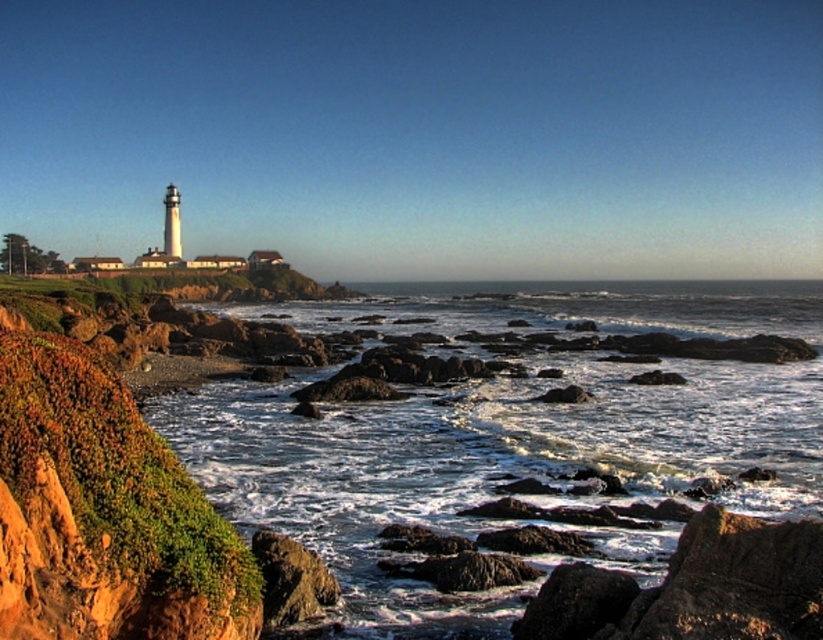
From the picture: Can you confirm if white frothy water at lower center is bigger than rustic rock cliff at left?

Yes, white frothy water at lower center is bigger than rustic rock cliff at left.

Is white frothy water at lower center to the right of rustic rock cliff at left from the viewer's perspective?

Indeed, white frothy water at lower center is positioned on the right side of rustic rock cliff at left.

Is point (661, 552) positioned in front of point (1, 536)?

No.

Where is `white frothy water at lower center`? white frothy water at lower center is located at coordinates (505, 428).

Can you confirm if white frothy water at lower center is positioned to the right of rusty rock at lower left?

Yes, white frothy water at lower center is to the right of rusty rock at lower left.

Which is more to the right, white frothy water at lower center or rusty rock at lower left?

white frothy water at lower center is more to the right.

Who is more distant from viewer, (x=431, y=516) or (x=310, y=612)?

The point (x=431, y=516) is behind.

Where is `white frothy water at lower center`? white frothy water at lower center is located at coordinates [505, 428].

Between rustic rock cliff at left and rusty rock at lower left, which one has less height?

Standing shorter between the two is rusty rock at lower left.

Who is taller, rustic rock cliff at left or rusty rock at lower left?

rustic rock cliff at left is taller.

Where is `rustic rock cliff at left`? rustic rock cliff at left is located at coordinates (x=103, y=509).

The width and height of the screenshot is (823, 640). I want to click on rustic rock cliff at left, so click(103, 509).